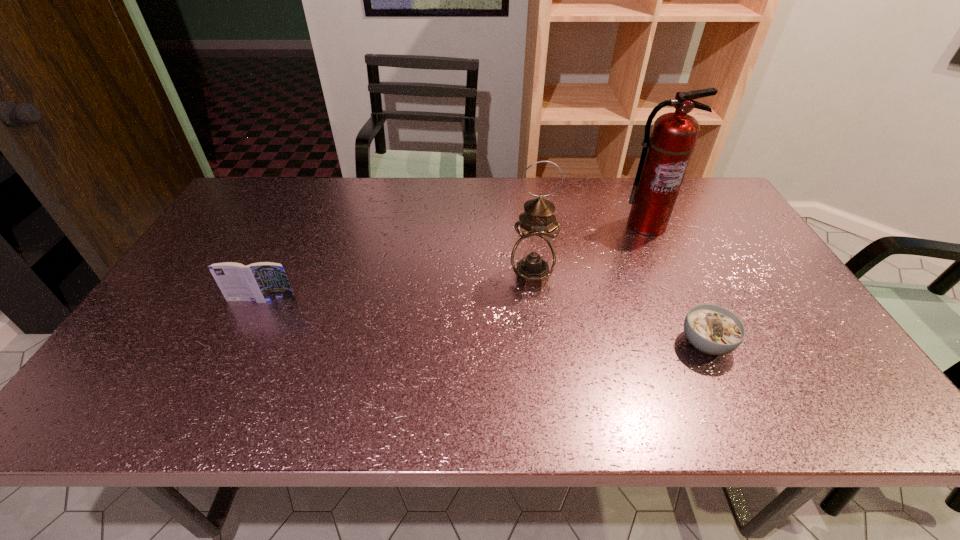
This screenshot has height=540, width=960. In order to click on vacant point located 0.190m on the front cover of the leftmost object in this screenshot , I will do `click(230, 364)`.

The height and width of the screenshot is (540, 960). I want to click on vacant space located on the right of the nearest object, so click(x=762, y=343).

Locate an element on the screen. object at the far edge is located at coordinates (665, 156).

Where is `vacant point at the far edge`? The width and height of the screenshot is (960, 540). vacant point at the far edge is located at coordinates (382, 187).

What are the coordinates of `vacant space at the near edge` in the screenshot? It's located at (430, 407).

This screenshot has width=960, height=540. I want to click on blank space at the left edge of the desktop, so click(x=222, y=258).

The width and height of the screenshot is (960, 540). I want to click on free space at the right edge of the desktop, so click(709, 259).

You are a GUI agent. You are given a task and a screenshot of the screen. Output one action in this format:
    pyautogui.click(x=<x>, y=<y>)
    Task: Click on the vacant space at the far left corner
    
    Given the screenshot: What is the action you would take?
    pyautogui.click(x=250, y=189)

Where is `free spot between the leftmost object and the farthest object`? free spot between the leftmost object and the farthest object is located at coordinates (454, 262).

This screenshot has width=960, height=540. Identify the location of vacant area that lies between the farthest object and the oil lamp. (589, 251).